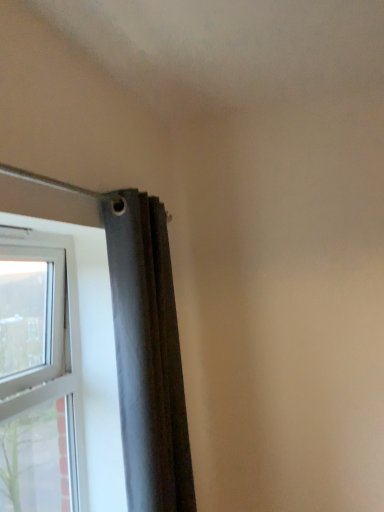
Question: Considering their positions, is white plastic window at left located in front of or behind dark gray fabric curtain at upper left?

Choices:
 (A) front
 (B) behind

Answer: (A)

Question: Does point (44, 290) appear closer or farther from the camera than point (158, 396)?

Choices:
 (A) farther
 (B) closer

Answer: (A)

Question: Based on their positions, is white plastic window at left located to the left or right of dark gray fabric curtain at upper left?

Choices:
 (A) right
 (B) left

Answer: (B)

Question: Looking at their shapes, would you say dark gray fabric curtain at upper left is wider or thinner than white plastic window at left?

Choices:
 (A) wide
 (B) thin

Answer: (A)

Question: From the image's perspective, is dark gray fabric curtain at upper left above or below white plastic window at left?

Choices:
 (A) below
 (B) above

Answer: (B)

Question: Relative to white plastic window at left, is dark gray fabric curtain at upper left in front or behind?

Choices:
 (A) behind
 (B) front

Answer: (A)

Question: Based on their positions, is dark gray fabric curtain at upper left located to the left or right of white plastic window at left?

Choices:
 (A) left
 (B) right

Answer: (B)